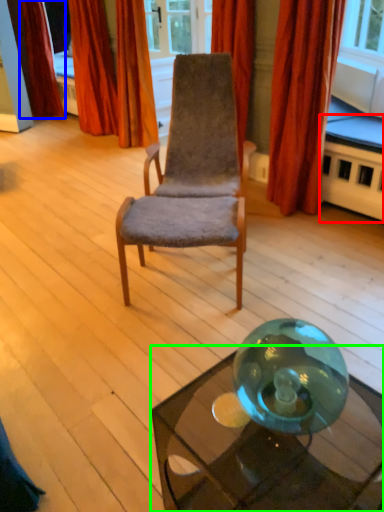
Question: Based on their relative distances, which object is nearer to table (highlighted by a red box)? Choose from curtain (highlighted by a blue box) and table (highlighted by a green box).

Choices:
 (A) curtain
 (B) table

Answer: (B)